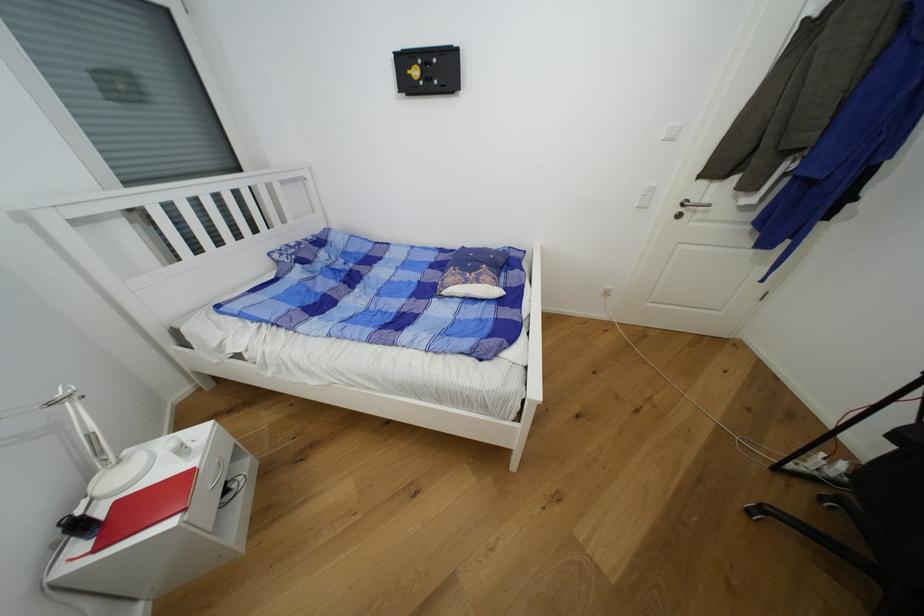
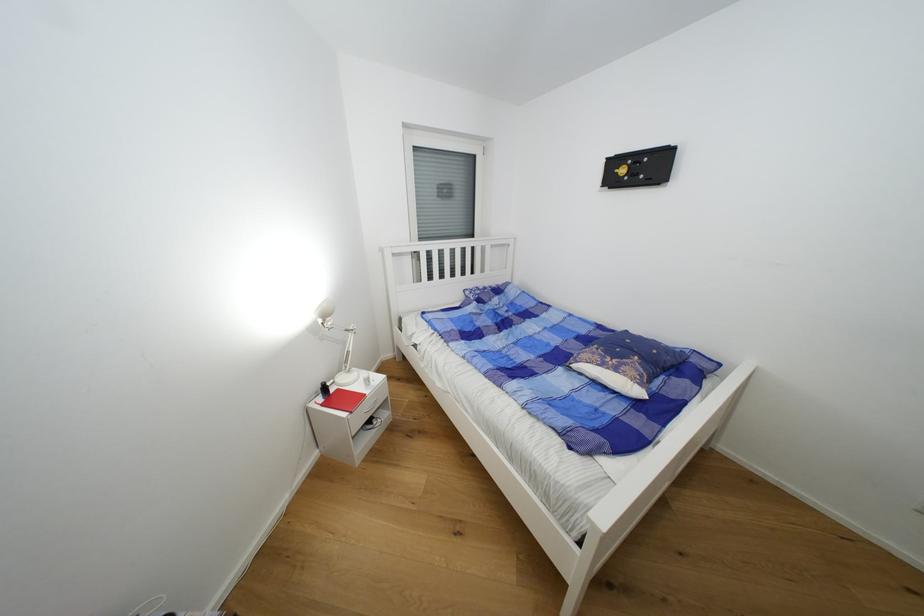
The point at (x=124, y=505) is marked in the first image. Where is the corresponding point in the second image?

(344, 392)